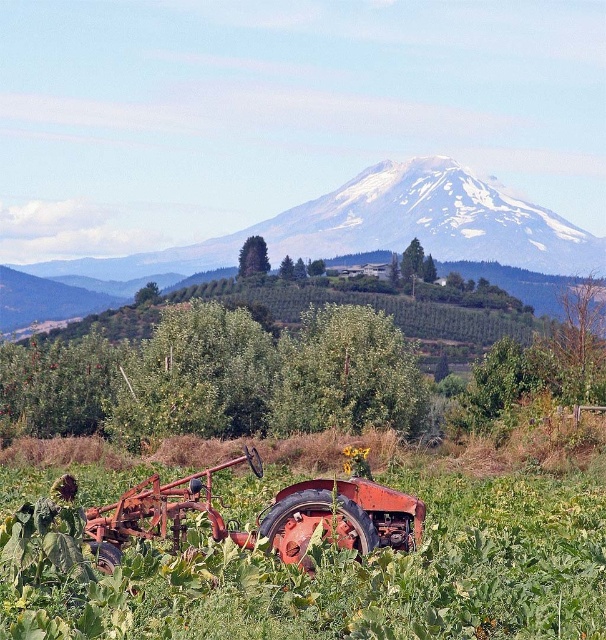
Question: Which point is closer to the camera?

Choices:
 (A) click(547, 497)
 (B) click(335, 538)

Answer: (B)

Question: Is green leafy grass at center positioned before rusty metal tractor at lower center?

Choices:
 (A) yes
 (B) no

Answer: (A)

Question: Can you confirm if green leafy grass at center is thinner than rusty metal tractor at lower center?

Choices:
 (A) yes
 (B) no

Answer: (B)

Question: Is green leafy grass at center closer to the viewer compared to rusty metal tractor at lower center?

Choices:
 (A) no
 (B) yes

Answer: (B)

Question: Which of the following is the farthest from the observer?

Choices:
 (A) (367, 508)
 (B) (179, 566)

Answer: (A)